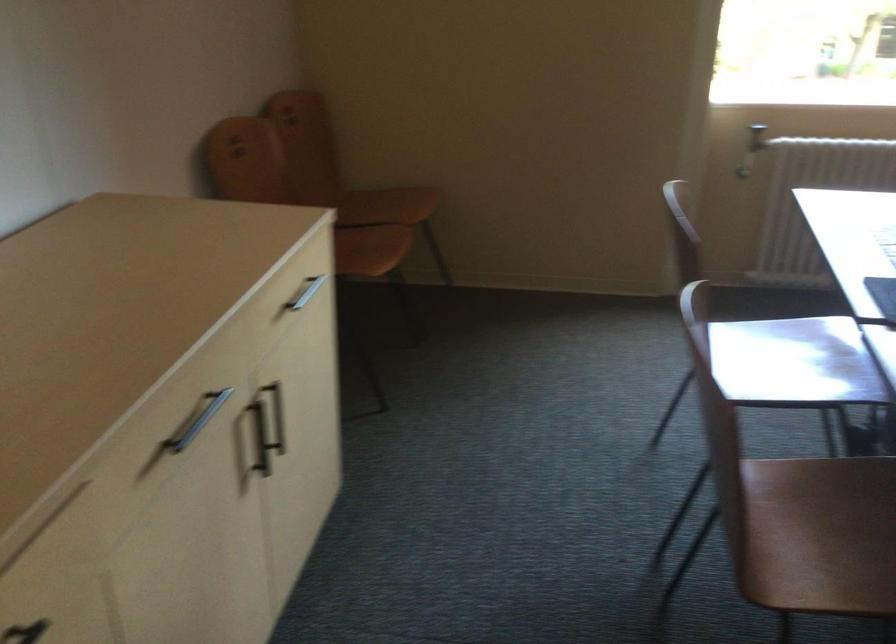
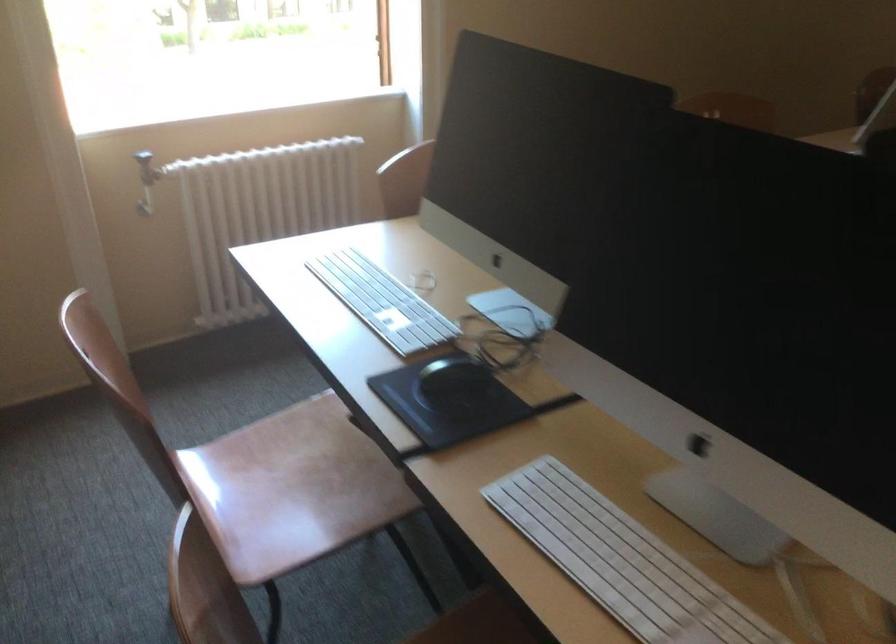
Where in the second image is the point corresponding to point 737,124 from the first image?

(147, 167)